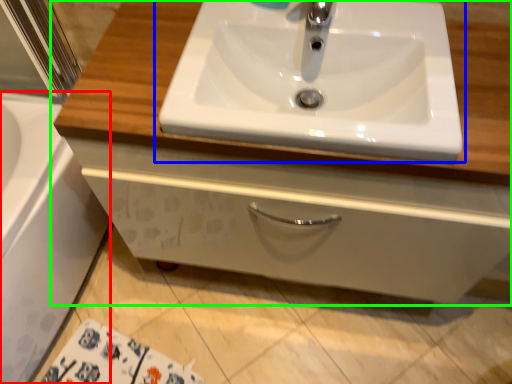
Question: Which object is positioned farthest from bath (highlighted by a red box)? Select from sink (highlighted by a blue box) and bathroom cabinet (highlighted by a green box).

Choices:
 (A) sink
 (B) bathroom cabinet

Answer: (A)